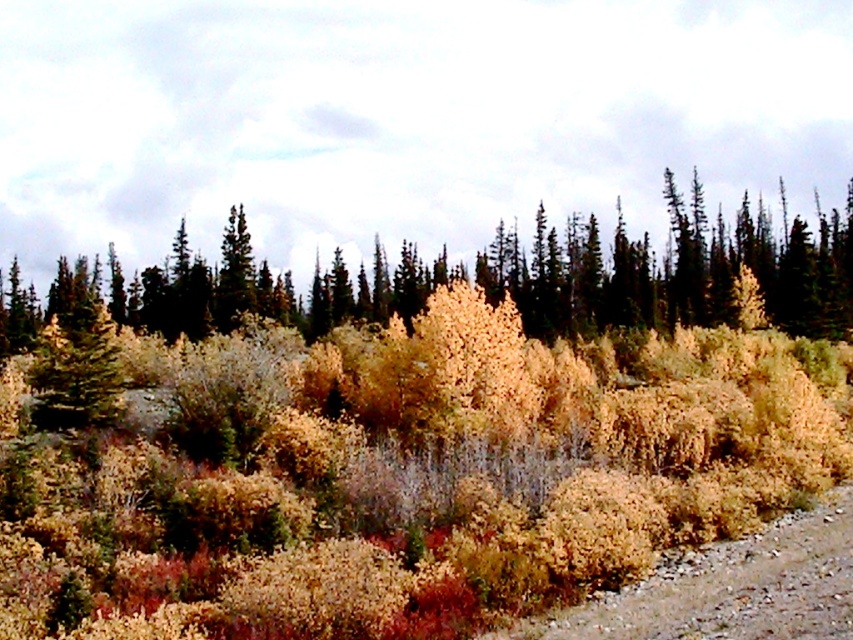
The height and width of the screenshot is (640, 853). What do you see at coordinates (676, 272) in the screenshot?
I see `golden textured shrub at center` at bounding box center [676, 272].

Describe the element at coordinates (676, 272) in the screenshot. I see `golden textured shrub at center` at that location.

You are a GUI agent. You are given a task and a screenshot of the screen. Output one action in this format:
    pyautogui.click(x=<x>, y=<y>)
    Task: Click on the golden textured shrub at center
    The image size is (853, 640).
    Given the screenshot: What is the action you would take?
    pyautogui.click(x=676, y=272)

Is golden dry shrubs at center bigger than brown gravel at lower right?

Correct, golden dry shrubs at center is larger in size than brown gravel at lower right.

Between point (53, 360) and point (694, 554), which one is positioned in front?

Point (694, 554) is in front.

Locate an element on the screen. golden dry shrubs at center is located at coordinates (395, 451).

Is golden dry shrubs at center below golden textured shrub at center?

Correct, golden dry shrubs at center is located below golden textured shrub at center.

Which is in front, point (776, 394) or point (30, 326)?

Point (776, 394) is in front.

Between point (234, 557) and point (718, 298), which one is positioned in front?

Point (234, 557) is in front.

What are the coordinates of `golden dry shrubs at center` in the screenshot? It's located at (395, 451).